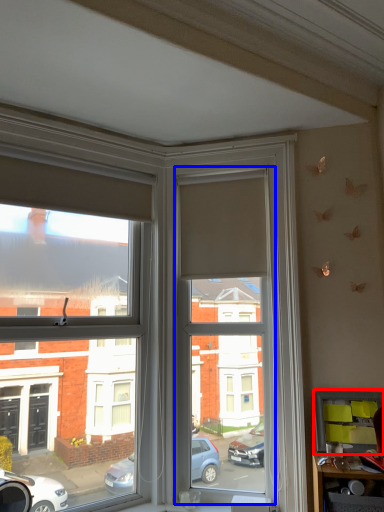
Question: Among these objects, which one is nearest to the camera, shelf (highlighted by a red box) or window screen (highlighted by a blue box)?

Choices:
 (A) shelf
 (B) window screen

Answer: (A)